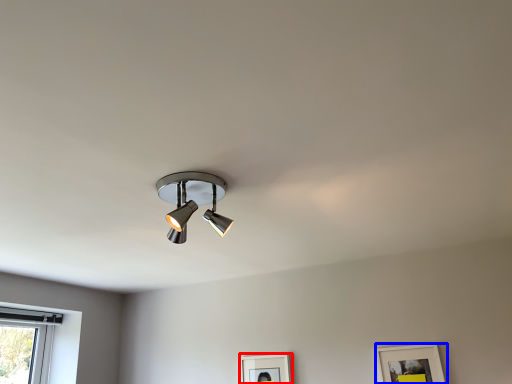
Question: Which object appears closest to the camera in this image, picture frame (highlighted by a red box) or picture frame (highlighted by a blue box)?

Choices:
 (A) picture frame
 (B) picture frame

Answer: (B)